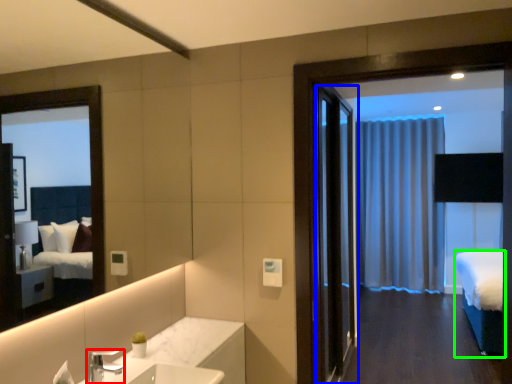
Question: Considering the real-world distances, which object is closest to tap (highlighted by a red box)? door (highlighted by a blue box) or bed (highlighted by a green box).

Choices:
 (A) door
 (B) bed

Answer: (B)